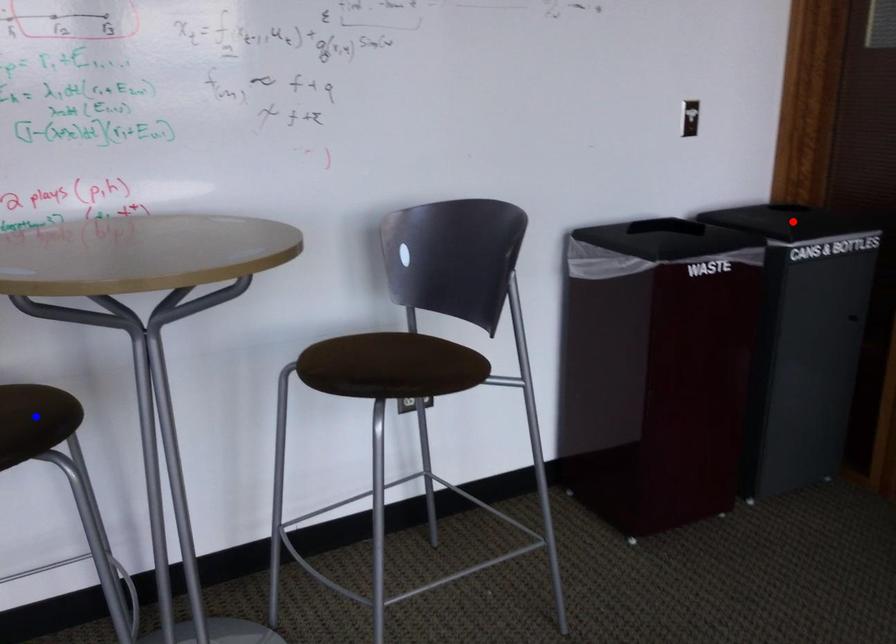
Question: Which of the two points in the image is closer to the camera?

Choices:
 (A) Blue point is closer.
 (B) Red point is closer.

Answer: (A)